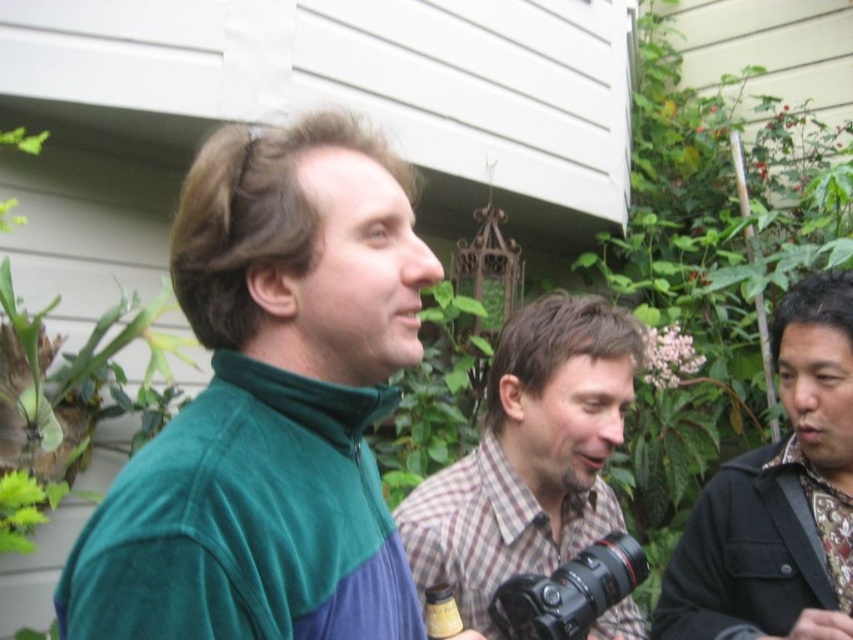
You are trying to find the person wearing the plaid fabric shirt at center and the black textured shirt at right in the garden. Based on their positions, which one is standing to the left of the other?

The plaid fabric shirt at center is positioned on the left side of black textured shirt at right, so the plaid fabric shirt at center is to the left of the black textured shirt at right.

You are trying to take a photo of the green fleece jacket at center and the black plastic camera at center using a smartphone. Can you fit both objects in the frame without moving your phone?

The green fleece jacket at center might be wider than the black plastic camera at center, so it depends on the distance between them and the camera angle. If they are close enough, both can fit in the frame.